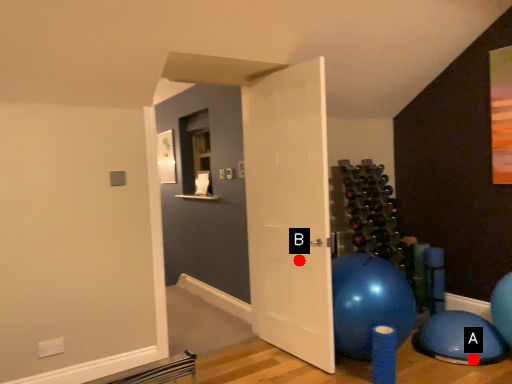
Question: Two points are circled on the image, labeled by A and B beside each circle. Which of the following is the farthest from the observer?

Choices:
 (A) A is further
 (B) B is further

Answer: (B)